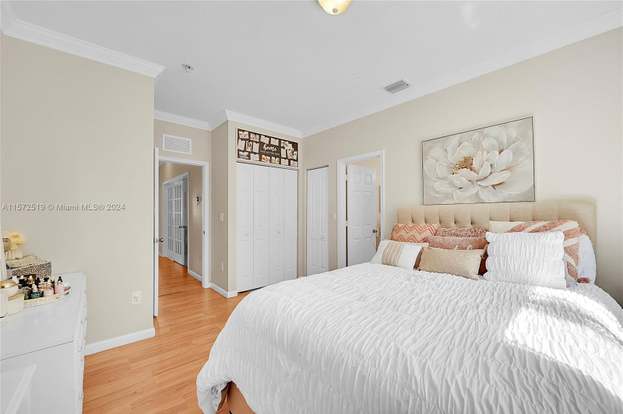
Identify the location of doors. Image resolution: width=623 pixels, height=414 pixels. (361, 220), (318, 227), (270, 216), (156, 240), (171, 212).